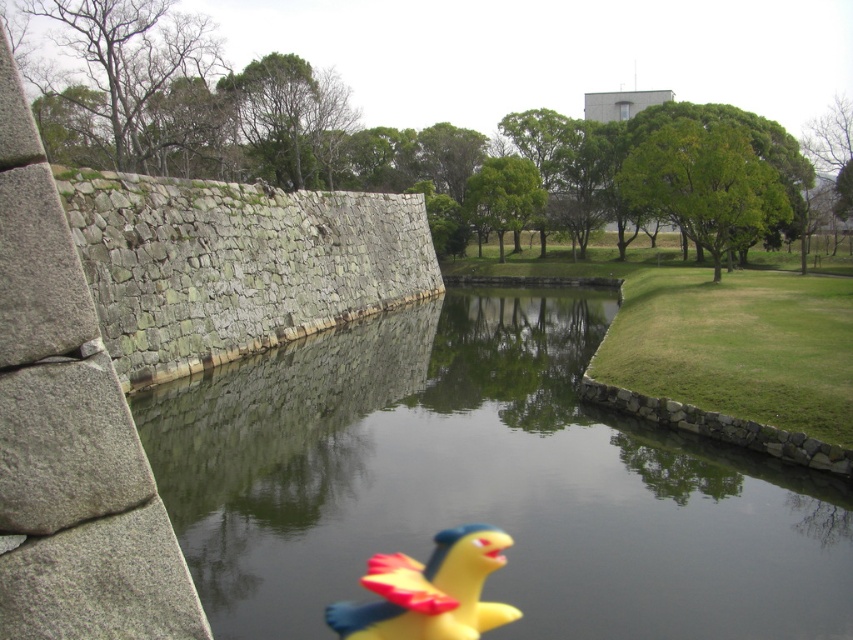
This screenshot has height=640, width=853. Describe the element at coordinates (483, 483) in the screenshot. I see `clear glass water at center` at that location.

How distant is clear glass water at center from yellow rubber duck at center?

clear glass water at center and yellow rubber duck at center are 40.00 feet apart.

Is point (828, 497) closer to camera compared to point (410, 582)?

No.

Where is `clear glass water at center`? The image size is (853, 640). clear glass water at center is located at coordinates (483, 483).